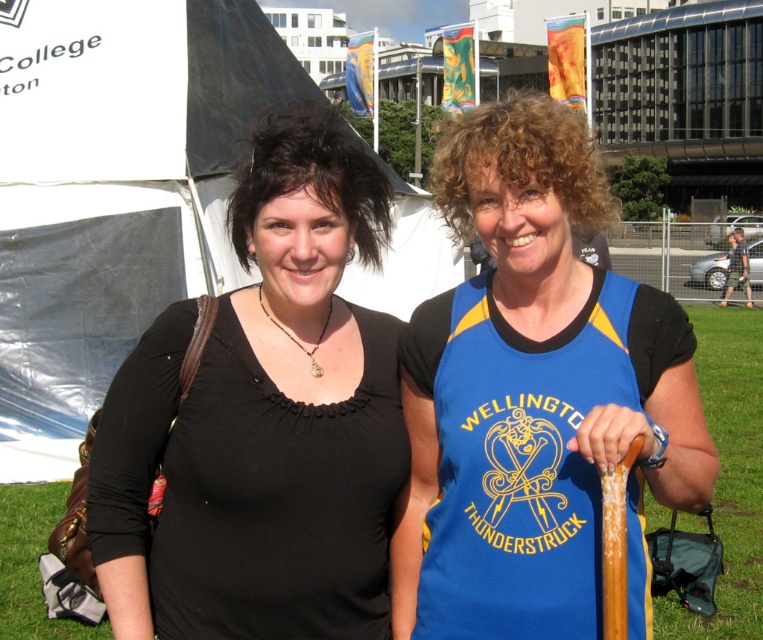
You are organizing a small event and need to place a decorative flag between the blue jersey at center and the white fabric tent at upper left. Which object should the flag be closer to if it needs to be closer to the narrower object?

The flag should be closer to the blue jersey at center because it has a lesser width compared to the white fabric tent at upper left.

You are taking a photo of the black matte shirt at center and the green grass at lower left. Which object will appear larger in the photo?

The black matte shirt at center will appear larger in the photo because it is closer to the viewer than the green grass at lower left.